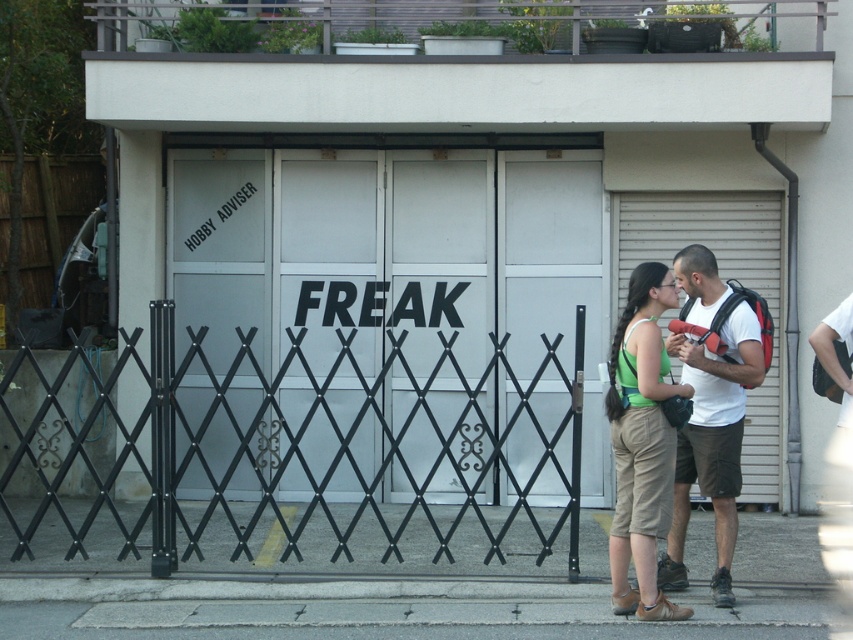
Describe the element at coordinates (270, 444) in the screenshot. I see `black metal fence at center` at that location.

Who is shorter, black metal fence at center or green fabric tank top at lower center?

Standing shorter between the two is black metal fence at center.

This screenshot has width=853, height=640. What do you see at coordinates (270, 444) in the screenshot? I see `black metal fence at center` at bounding box center [270, 444].

You are a GUI agent. You are given a task and a screenshot of the screen. Output one action in this format:
    pyautogui.click(x=<x>, y=<y>)
    Task: Click on the black metal fence at center
    Image resolution: width=853 pixels, height=640 pixels.
    Given the screenshot: What is the action you would take?
    pyautogui.click(x=270, y=444)

In order to click on matte glass garage door at center in this screenshot , I will do `click(399, 280)`.

Who is more distant from viewer, (x=409, y=412) or (x=706, y=276)?

Positioned behind is point (x=409, y=412).

Where is `matte glass garage door at center`? matte glass garage door at center is located at coordinates (399, 280).

Who is taller, green fabric tank top at lower center or white matte t-shirt at center?

Standing taller between the two is white matte t-shirt at center.

Which is more to the left, green fabric tank top at lower center or white matte t-shirt at center?

green fabric tank top at lower center is more to the left.

The image size is (853, 640). I want to click on green fabric tank top at lower center, so click(x=641, y=442).